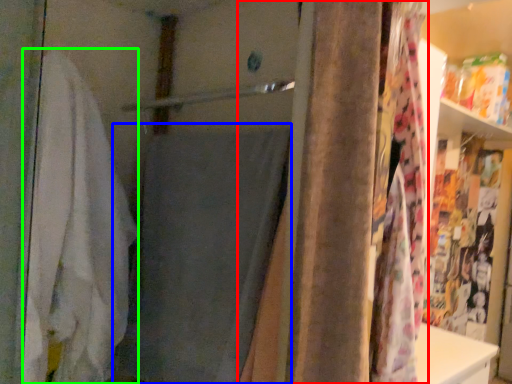
Question: Estimate the real-world distances between objects in this image. Which object is closer to curtain (highlighted by a red box), bath towel (highlighted by a blue box) or bath towel (highlighted by a green box)?

Choices:
 (A) bath towel
 (B) bath towel

Answer: (A)